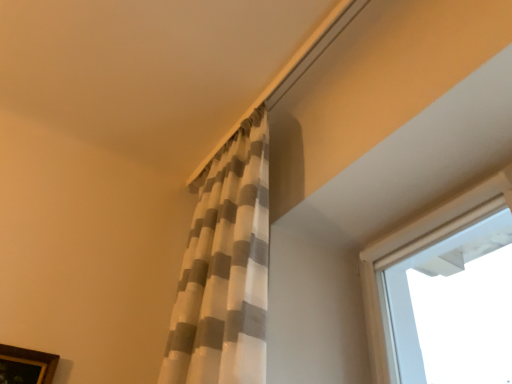
Describe the element at coordinates (26, 366) in the screenshot. I see `brown wooden picture frame at lower left` at that location.

Where is `brown wooden picture frame at lower left`? This screenshot has width=512, height=384. brown wooden picture frame at lower left is located at coordinates (26, 366).

At what (x,y) coordinates should I click in order to perform the action: click on white textured curtain at upper center. Please return your answer as a coordinate pair (x, y). The width and height of the screenshot is (512, 384). Looking at the image, I should click on (225, 268).

This screenshot has width=512, height=384. What do you see at coordinates (225, 268) in the screenshot? I see `white textured curtain at upper center` at bounding box center [225, 268].

Where is `brown wooden picture frame at lower left`? brown wooden picture frame at lower left is located at coordinates (26, 366).

Considering the positions of objects white textured curtain at upper center and brown wooden picture frame at lower left in the image provided, who is more to the right, white textured curtain at upper center or brown wooden picture frame at lower left?

From the viewer's perspective, white textured curtain at upper center appears more on the right side.

From the picture: Considering the relative positions of white textured curtain at upper center and brown wooden picture frame at lower left in the image provided, is white textured curtain at upper center in front of brown wooden picture frame at lower left?

Yes, the depth of white textured curtain at upper center is less than that of brown wooden picture frame at lower left.

Which is closer to the camera, (254, 174) or (19, 359)?

The point (19, 359) is in front.

From the image's perspective, which is below, white textured curtain at upper center or brown wooden picture frame at lower left?

From the image's view, brown wooden picture frame at lower left is below.

From a real-world perspective, relative to brown wooden picture frame at lower left, is white textured curtain at upper center vertically above or below?

In terms of real-world spatial position, white textured curtain at upper center is above brown wooden picture frame at lower left.

Can you confirm if white textured curtain at upper center is wider than brown wooden picture frame at lower left?

Yes.

Considering the sizes of objects white textured curtain at upper center and brown wooden picture frame at lower left in the image provided, who is shorter, white textured curtain at upper center or brown wooden picture frame at lower left?

brown wooden picture frame at lower left is shorter.

Considering the relative sizes of white textured curtain at upper center and brown wooden picture frame at lower left in the image provided, is white textured curtain at upper center bigger than brown wooden picture frame at lower left?

Indeed, white textured curtain at upper center has a larger size compared to brown wooden picture frame at lower left.

Is white textured curtain at upper center not inside brown wooden picture frame at lower left?

That's correct, white textured curtain at upper center is outside of brown wooden picture frame at lower left.

Is white textured curtain at upper center in contact with brown wooden picture frame at lower left?

white textured curtain at upper center and brown wooden picture frame at lower left are clearly separated.

Is white textured curtain at upper center positioned with its back to brown wooden picture frame at lower left?

No, white textured curtain at upper center's orientation is not away from brown wooden picture frame at lower left.

How many degrees apart are the facing directions of white textured curtain at upper center and brown wooden picture frame at lower left?

There is a 90.2-degree angle between the facing directions of white textured curtain at upper center and brown wooden picture frame at lower left.

Based on the photo, measure the distance from white textured curtain at upper center to brown wooden picture frame at lower left.

white textured curtain at upper center is 67.41 centimeters away from brown wooden picture frame at lower left.

Locate an element on the screen. curtain in front of the brown wooden picture frame at lower left is located at coordinates (225, 268).

Which object is positioned more to the left, brown wooden picture frame at lower left or white textured curtain at upper center?

brown wooden picture frame at lower left.

Is brown wooden picture frame at lower left positioned in front of white textured curtain at upper center?

No, brown wooden picture frame at lower left is further to the viewer.

Is point (48, 362) closer to viewer compared to point (251, 305)?

That is False.

From the image's perspective, is brown wooden picture frame at lower left on white textured curtain at upper center?

No.

From a real-world perspective, which is physically above, brown wooden picture frame at lower left or white textured curtain at upper center?

In real-world perspective, white textured curtain at upper center is above.

In terms of width, does brown wooden picture frame at lower left look wider or thinner when compared to white textured curtain at upper center?

Clearly, brown wooden picture frame at lower left has less width compared to white textured curtain at upper center.

Does brown wooden picture frame at lower left have a greater height compared to white textured curtain at upper center?

No.

Who is bigger, brown wooden picture frame at lower left or white textured curtain at upper center?

white textured curtain at upper center is bigger.

Choose the correct answer: Is brown wooden picture frame at lower left inside white textured curtain at upper center or outside it?

brown wooden picture frame at lower left is outside white textured curtain at upper center.

Can you see brown wooden picture frame at lower left touching white textured curtain at upper center?

No, brown wooden picture frame at lower left is not with white textured curtain at upper center.

Is brown wooden picture frame at lower left turned away from white textured curtain at upper center?

brown wooden picture frame at lower left is not turned away from white textured curtain at upper center.

Can you tell me how much brown wooden picture frame at lower left and white textured curtain at upper center differ in facing direction?

brown wooden picture frame at lower left and white textured curtain at upper center are facing 90.2 degrees away from each other.

Locate an element on the screen. curtain in front of the brown wooden picture frame at lower left is located at coordinates (225, 268).

Find the location of a particular element. This screenshot has width=512, height=384. picture frame that is below the white textured curtain at upper center (from the image's perspective) is located at coordinates (26, 366).

Identify the location of curtain above the brown wooden picture frame at lower left (from the image's perspective). (225, 268).